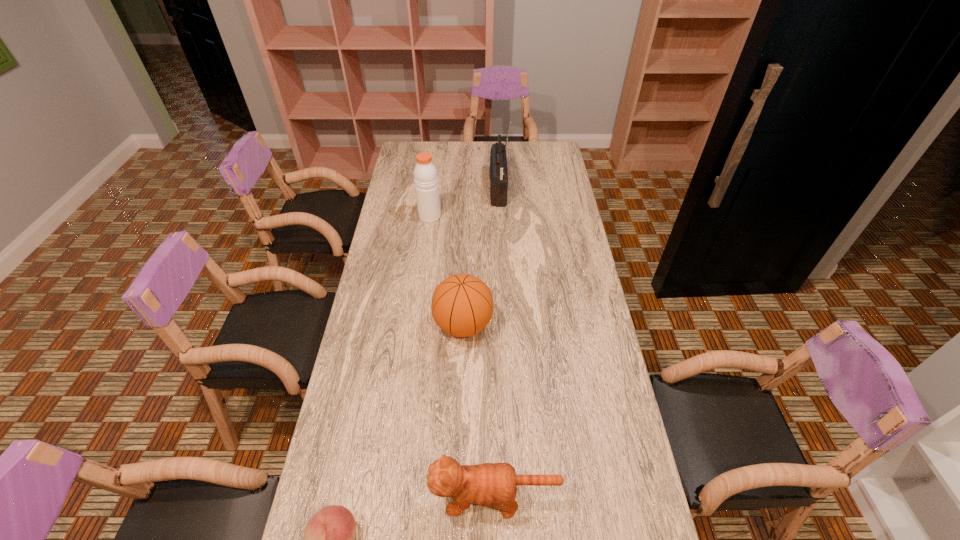
Locate an element on the screen. The width and height of the screenshot is (960, 540). vacant space located 0.110m on the face of the cat is located at coordinates (387, 497).

Where is `free location located 0.170m on the face of the cat`? This screenshot has height=540, width=960. free location located 0.170m on the face of the cat is located at coordinates (363, 497).

Image resolution: width=960 pixels, height=540 pixels. I want to click on vacant space located 0.070m on the face of the cat, so click(403, 497).

This screenshot has height=540, width=960. Identify the location of object located at the left edge. coord(425,173).

Identify the location of vacant space at the far edge. The width and height of the screenshot is (960, 540). (434, 142).

Identify the location of free space at the left edge of the desktop. (379, 433).

Identify the location of free spot at the right edge of the desktop. (634, 466).

The height and width of the screenshot is (540, 960). In order to click on vacant space at the far right corner of the desktop in this screenshot , I will do `click(546, 152)`.

The height and width of the screenshot is (540, 960). Find the location of `unoccupied area between the fourth shortest object and the third farthest object`. unoccupied area between the fourth shortest object and the third farthest object is located at coordinates (446, 271).

At what (x,y) coordinates should I click in order to perform the action: click on empty space between the third farthest object and the tallest object. Please return your answer as a coordinate pair (x, y). The width and height of the screenshot is (960, 540). Looking at the image, I should click on [481, 258].